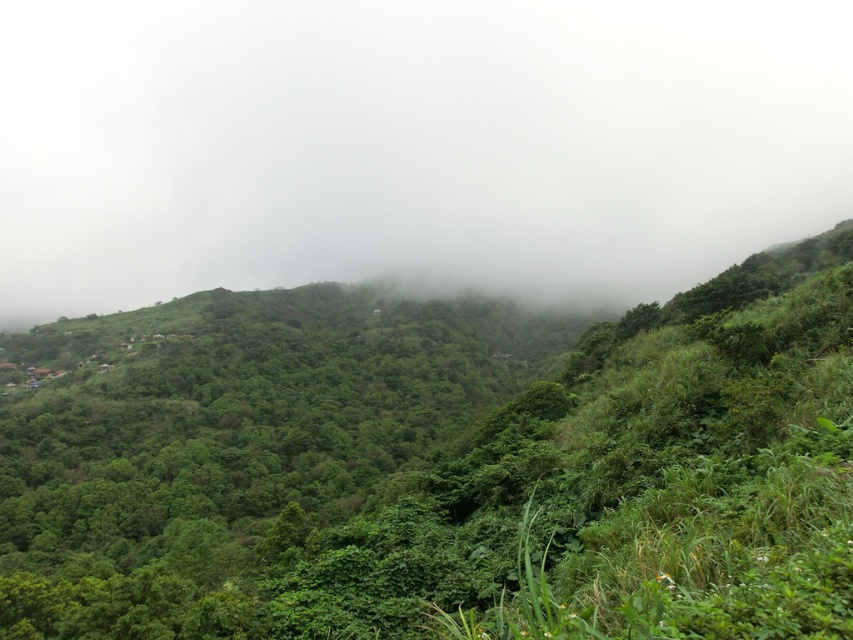
Measure the distance from green leafy vegetation at center to white foggy cloud at upper center.

The distance of green leafy vegetation at center from white foggy cloud at upper center is 1053.87 feet.

Locate an element on the screen. green leafy vegetation at center is located at coordinates (436, 465).

Which is in front, point (267, 449) or point (567, 168)?

Point (267, 449) is more forward.

Identify the location of green leafy vegetation at center. (436, 465).